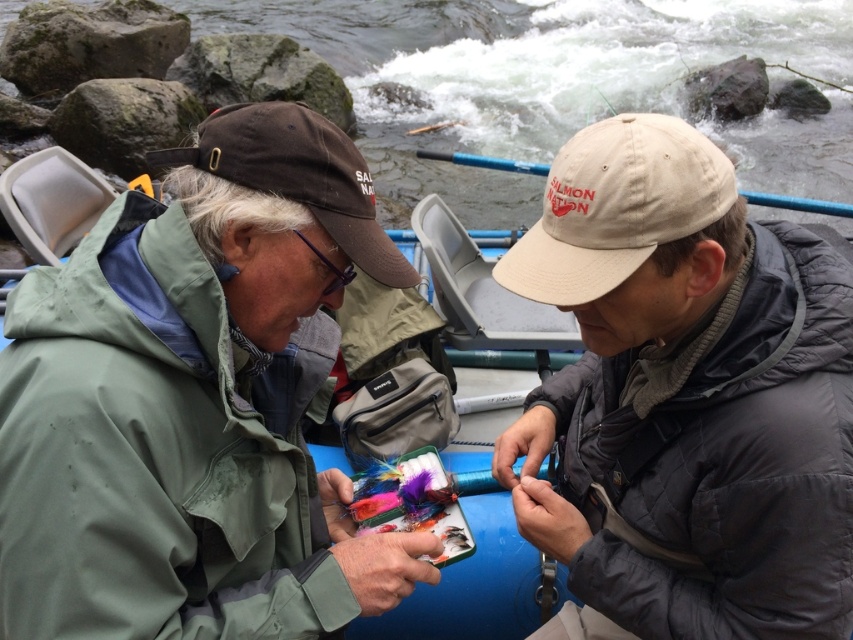
You are a photographer trying to capture both the beige fabric cap at center and the brown fabric baseball cap at upper left in a single frame. Which cap should you adjust to ensure both fit in the photo, considering their sizes?

The beige fabric cap at center is wider than the brown fabric baseball cap at upper left. To ensure both fit in the photo, you should adjust the angle or zoom to accommodate the wider beige fabric cap at center.

You are a photographer taking a picture of the two caps. You want to ensure both caps are visible in the frame. Given that the beige cotton cap at upper center is larger than the brown fabric baseball cap at upper left, which cap should you focus on to make sure both fit in the frame?

The beige cotton cap at upper center is larger than the brown fabric baseball cap at upper left. To ensure both fit in the frame, focus on positioning the larger beige cotton cap at upper center first, then adjust the camera angle to include the smaller brown fabric baseball cap at upper left.

What is the exact coordinate of the beige cotton cap at upper center?

The beige cotton cap at upper center is located at point (616, 205).